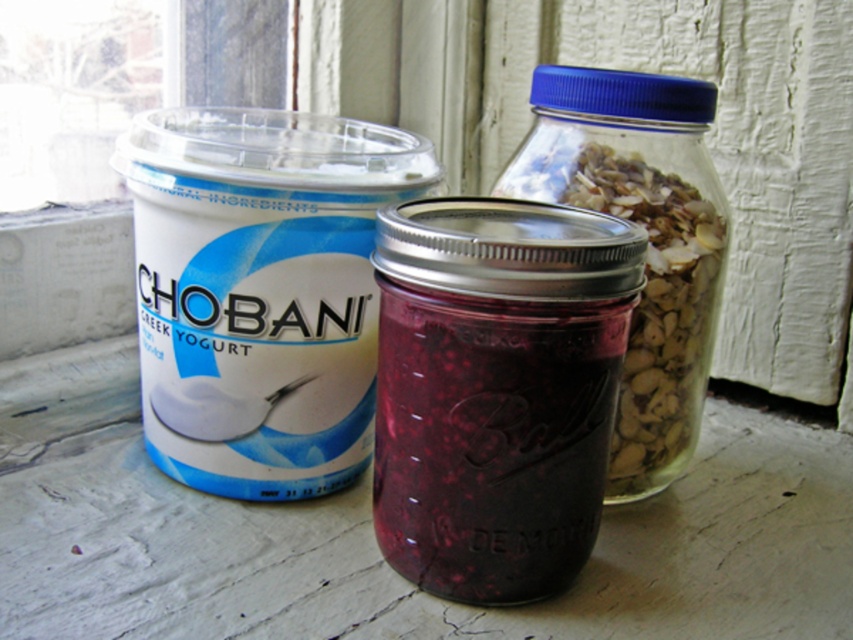
Question: Which object is farther from the camera taking this photo?

Choices:
 (A) clear glass jar at center
 (B) white matte yogurt at left

Answer: (A)

Question: Is white matte yogurt at left positioned before clear glass jar at center?

Choices:
 (A) no
 (B) yes

Answer: (B)

Question: Which object is closer to the camera taking this photo?

Choices:
 (A) white matte yogurt at left
 (B) clear glass jar at center

Answer: (A)

Question: Is the position of white matte yogurt at left less distant than that of clear glass jar at center?

Choices:
 (A) yes
 (B) no

Answer: (A)

Question: Can you confirm if white matte yogurt at left is positioned below clear glass jar at center?

Choices:
 (A) no
 (B) yes

Answer: (A)